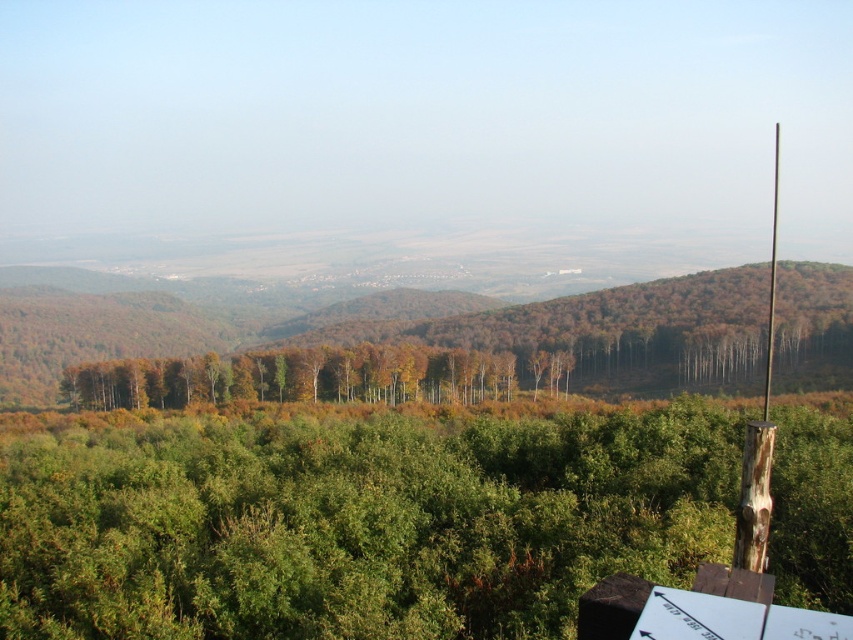
Where is `green leafy forest at center`? green leafy forest at center is located at coordinates (355, 522).

Does point (115, 493) come farther from viewer compared to point (767, 376)?

That is False.

Where is `green leafy forest at center`? This screenshot has width=853, height=640. green leafy forest at center is located at coordinates (355, 522).